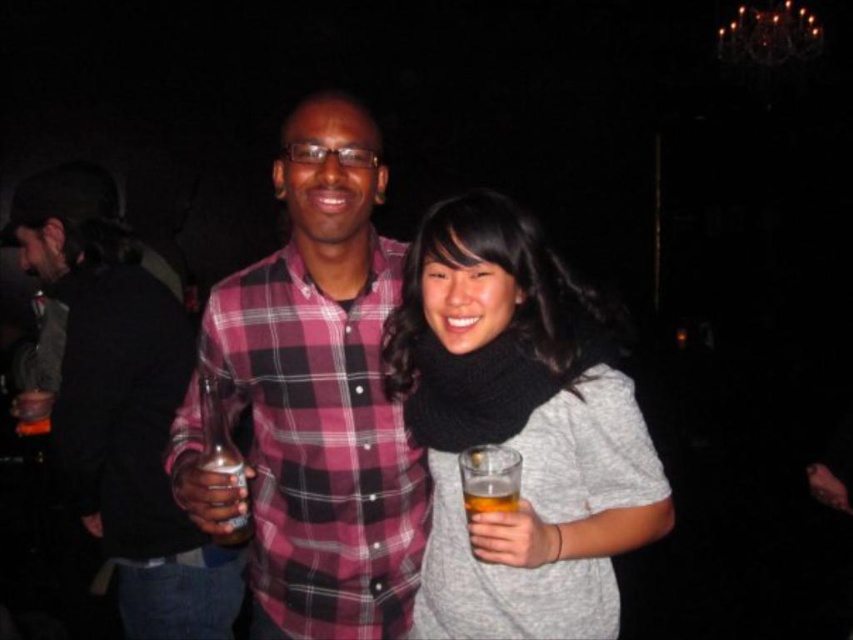
Question: Which point is farther to the camera?

Choices:
 (A) knitted black scarf at center
 (B) clear glass beer at center
 (C) translucent plastic cup at center
 (D) plaid cotton shirt at center

Answer: (C)

Question: Can you confirm if knitted black scarf at center is bigger than translucent plastic cup at center?

Choices:
 (A) no
 (B) yes

Answer: (B)

Question: Is knitted black scarf at center further to camera compared to translucent plastic cup at center?

Choices:
 (A) yes
 (B) no

Answer: (B)

Question: Can you confirm if plaid cotton shirt at center is thinner than plaid fabric shirt at center?

Choices:
 (A) no
 (B) yes

Answer: (B)

Question: Which of these objects is positioned closest to the translucent plastic cup at center?

Choices:
 (A) plaid fabric shirt at center
 (B) clear glass beer at center

Answer: (B)

Question: Which point is farther from the camera taking this photo?

Choices:
 (A) (x=492, y=484)
 (B) (x=575, y=388)

Answer: (B)